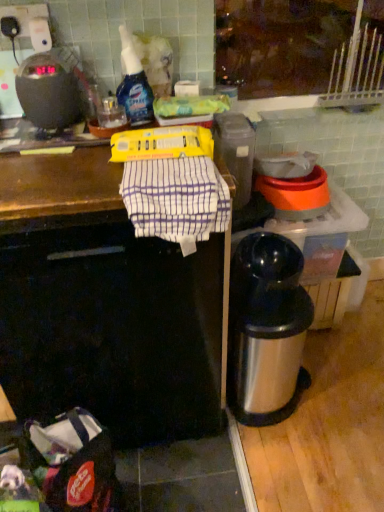
Locate an element on the screen. The width and height of the screenshot is (384, 512). vacant area located to the right-hand side of silver metallic thermos at lower right is located at coordinates (342, 385).